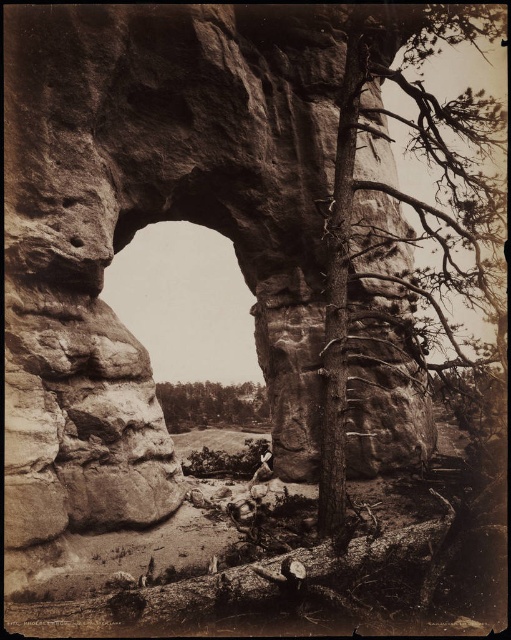
Question: Is smooth brown log at lower center further to the viewer compared to green leafy tree at center?

Choices:
 (A) no
 (B) yes

Answer: (A)

Question: Can you confirm if smooth brown log at lower center is smaller than green leafy tree at center?

Choices:
 (A) no
 (B) yes

Answer: (B)

Question: Which point is closer to the camera?

Choices:
 (A) smooth brown log at lower center
 (B) green leafy tree at center

Answer: (A)

Question: Among these points, which one is farthest from the camera?

Choices:
 (A) (169, 538)
 (B) (243, 390)

Answer: (B)

Question: Is smooth brown log at lower center positioned in front of green leafy tree at center?

Choices:
 (A) no
 (B) yes

Answer: (B)

Question: Which point appears farthest from the camera in this image?

Choices:
 (A) (262, 593)
 (B) (218, 406)

Answer: (B)